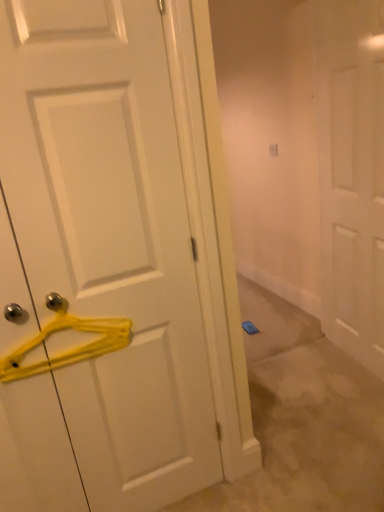
Question: Is white matte door at center, which is the second door in left-to-right order, taller or shorter than white matte door at left, which appears as the 2th door when viewed from the back?

Choices:
 (A) short
 (B) tall

Answer: (B)

Question: From the image's perspective, is white matte door at center, which is the second door in left-to-right order, above or below white matte door at left, the second door positioned from the right?

Choices:
 (A) below
 (B) above

Answer: (B)

Question: Which is nearer to the white matte door at center, the 1th door from the right?

Choices:
 (A) yellow plastic hanger at left
 (B) white matte door at left, the second door positioned from the right

Answer: (B)

Question: Which object is the closest to the white matte door at left, which is counted as the first door, starting from the left?

Choices:
 (A) white matte door at center, the first door positioned from the back
 (B) yellow plastic hanger at left

Answer: (B)